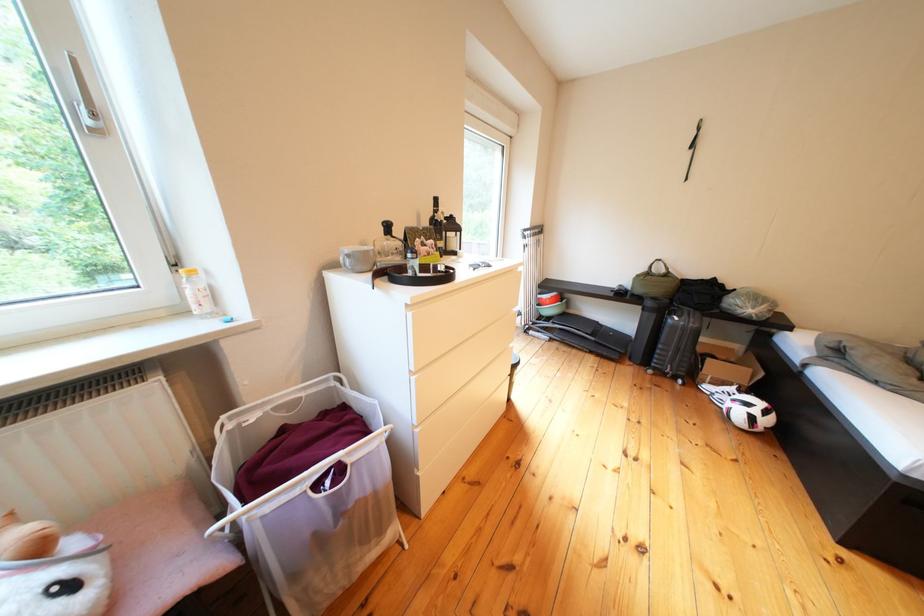
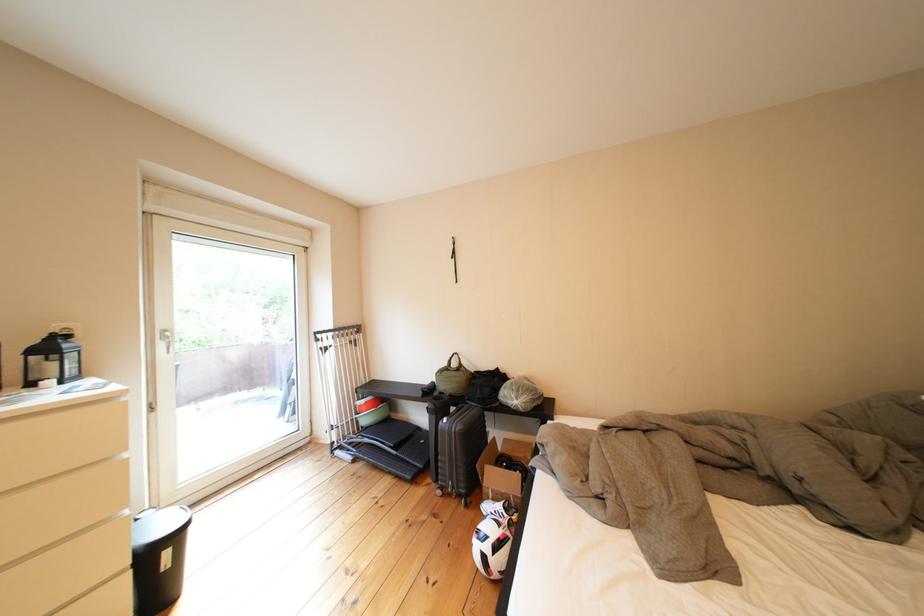
Find the pixel in the second image that matches the point at 766,422 in the first image.

(499, 562)